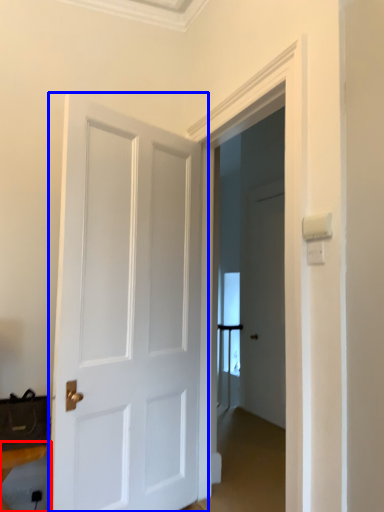
Question: Which object appears farthest to the camera in this image, furniture (highlighted by a red box) or door (highlighted by a blue box)?

Choices:
 (A) furniture
 (B) door

Answer: (B)